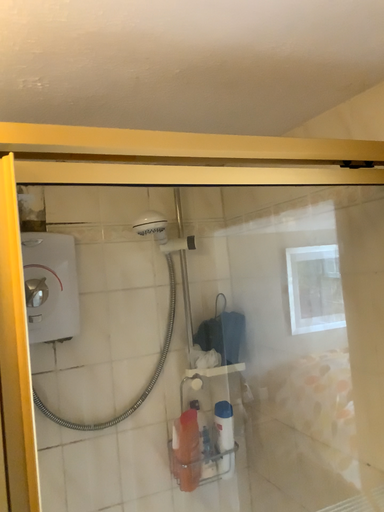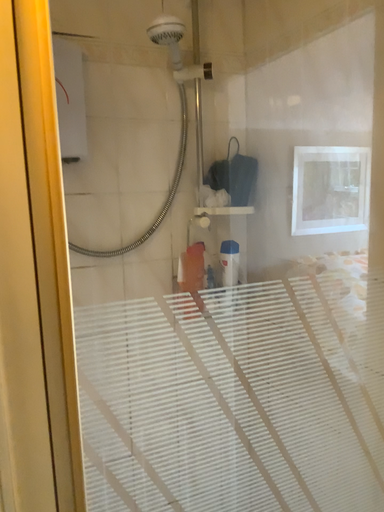
Question: How did the camera likely rotate when shooting the video?

Choices:
 (A) rotated downward
 (B) rotated upward

Answer: (A)